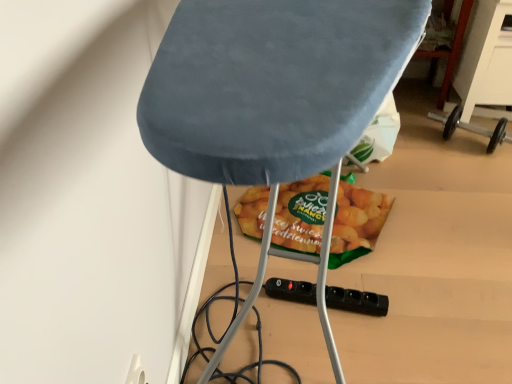
Where is `unoccupied space behind black plastic socket at lower center`? The height and width of the screenshot is (384, 512). unoccupied space behind black plastic socket at lower center is located at coordinates (318, 254).